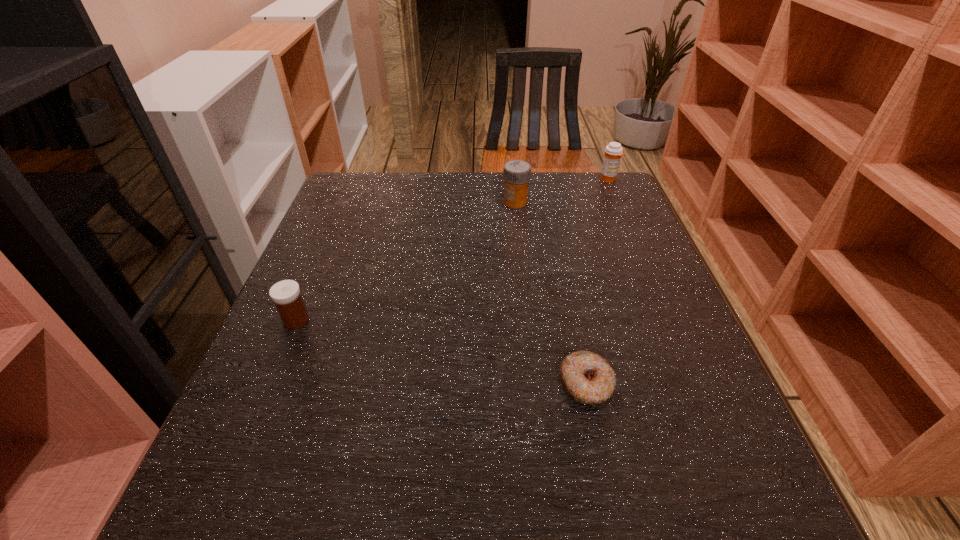
I want to click on the rightmost object, so click(x=613, y=152).

You are a GUI agent. You are given a task and a screenshot of the screen. Output one action in this format:
    pyautogui.click(x=<x>, y=<y>)
    Task: Click on the farthest medicine
    
    Given the screenshot: What is the action you would take?
    pyautogui.click(x=613, y=152)

Identify the location of the third nearest object. The image size is (960, 540). (517, 173).

I want to click on the second medicine from left to right, so click(x=517, y=173).

Locate an element on the screen. The image size is (960, 540). the shortest medicine is located at coordinates (286, 295).

You are a GUI agent. You are given a task and a screenshot of the screen. Output one action in this format:
    pyautogui.click(x=<x>, y=<y>)
    Task: Click on the nearest medicine
    
    Given the screenshot: What is the action you would take?
    pyautogui.click(x=286, y=295)

Identify the location of doughnut. (587, 377).

The image size is (960, 540). I want to click on the nearest object, so click(587, 377).

This screenshot has height=540, width=960. What are the coordinates of `vacant space located 0.210m on the left of the rightmost medicine` in the screenshot? It's located at (529, 179).

Where is `vacant space situated on the label side of the second nearest medicine`? The image size is (960, 540). vacant space situated on the label side of the second nearest medicine is located at coordinates (415, 202).